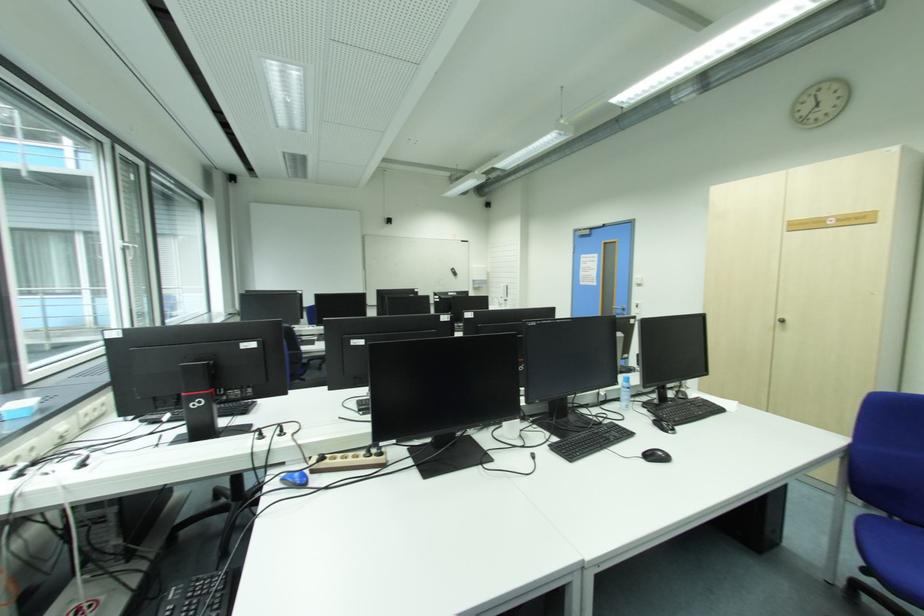
You are a GUI agent. You are given a task and a screenshot of the screen. Output one action in this format:
    pyautogui.click(x=<x>, y=<y>)
    Task: Click on the window handle
    
    Given the screenshot: What is the action you would take?
    [x=129, y=248]